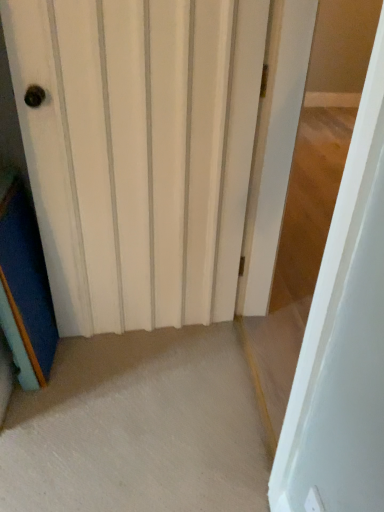
The image size is (384, 512). What do you see at coordinates (343, 340) in the screenshot?
I see `white matte door at center, acting as the second door starting from the left` at bounding box center [343, 340].

You are a GUI agent. You are given a task and a screenshot of the screen. Output one action in this format:
    pyautogui.click(x=<x>, y=<y>)
    Task: Click on the white matte door at center, the 1th door when ordered from right to left
    The image size is (384, 512).
    Given the screenshot: What is the action you would take?
    pyautogui.click(x=343, y=340)

At what (x,y) coordinates should I click in order to perform the action: click on white wood door at center, positioned as the 1th door in left-to-right order. Please return your answer as a coordinate pair (x, y). This screenshot has width=384, height=512. Looking at the image, I should click on (139, 152).

What is the approximate height of white wood door at center, positioned as the 1th door in left-to-right order?

It is 4.07 feet.

The image size is (384, 512). What do you see at coordinates (139, 152) in the screenshot?
I see `white wood door at center, positioned as the 1th door in left-to-right order` at bounding box center [139, 152].

Identify the location of white matte door at center, the 1th door when ordered from right to left. Image resolution: width=384 pixels, height=512 pixels. (343, 340).

Is white matte door at center, the 1th door when ordered from right to left, at the left side of white wood door at center, arranged as the second door when viewed from the right?

In fact, white matte door at center, the 1th door when ordered from right to left, is to the right of white wood door at center, arranged as the second door when viewed from the right.

Is white matte door at center, the 1th door when ordered from right to left, further to camera compared to white wood door at center, arranged as the second door when viewed from the right?

No, white matte door at center, the 1th door when ordered from right to left, is closer to the viewer.

Considering the positions of point (365, 496) and point (26, 147), is point (365, 496) closer or farther from the camera than point (26, 147)?

Point (365, 496) appears to be closer to the viewer than point (26, 147).

From the image's perspective, is white matte door at center, acting as the second door starting from the left, positioned above or below white wood door at center, positioned as the 1th door in left-to-right order?

From the image's perspective, white matte door at center, acting as the second door starting from the left, appears below white wood door at center, positioned as the 1th door in left-to-right order.

From a real-world perspective, is white matte door at center, the 1th door when ordered from right to left, located beneath white wood door at center, positioned as the 1th door in left-to-right order?

Incorrect, from a real-world perspective, white matte door at center, the 1th door when ordered from right to left, is higher than white wood door at center, positioned as the 1th door in left-to-right order.

Considering the relative sizes of white matte door at center, acting as the second door starting from the left, and white wood door at center, positioned as the 1th door in left-to-right order, in the image provided, is white matte door at center, acting as the second door starting from the left, wider than white wood door at center, positioned as the 1th door in left-to-right order,?

A: Yes, white matte door at center, acting as the second door starting from the left, is wider than white wood door at center, positioned as the 1th door in left-to-right order.

Considering the sizes of white matte door at center, acting as the second door starting from the left, and white wood door at center, positioned as the 1th door in left-to-right order, in the image, is white matte door at center, acting as the second door starting from the left, taller or shorter than white wood door at center, positioned as the 1th door in left-to-right order,?

Clearly, white matte door at center, acting as the second door starting from the left, is taller compared to white wood door at center, positioned as the 1th door in left-to-right order.

Can you confirm if white matte door at center, acting as the second door starting from the left, is bigger than white wood door at center, arranged as the second door when viewed from the right?

Indeed, white matte door at center, acting as the second door starting from the left, has a larger size compared to white wood door at center, arranged as the second door when viewed from the right.

Can white wood door at center, positioned as the 1th door in left-to-right order, be found inside white matte door at center, acting as the second door starting from the left?

Definitely not — white wood door at center, positioned as the 1th door in left-to-right order, is not inside white matte door at center, acting as the second door starting from the left.

Can you see white matte door at center, acting as the second door starting from the left, touching white wood door at center, positioned as the 1th door in left-to-right order?

They are not placed beside each other.

Is white matte door at center, acting as the second door starting from the left, facing away from white wood door at center, positioned as the 1th door in left-to-right order?

No.

How different are the orientations of white matte door at center, the 1th door when ordered from right to left, and white wood door at center, arranged as the second door when viewed from the right, in degrees?

94.6 degrees separate the facing orientations of white matte door at center, the 1th door when ordered from right to left, and white wood door at center, arranged as the second door when viewed from the right.

The width and height of the screenshot is (384, 512). In the image, there is a white matte door at center, acting as the second door starting from the left. In order to click on door below it (from a real-world perspective) in this screenshot , I will do `click(139, 152)`.

Visually, is white wood door at center, arranged as the second door when viewed from the right, positioned to the left or to the right of white matte door at center, acting as the second door starting from the left?

white wood door at center, arranged as the second door when viewed from the right, is to the left of white matte door at center, acting as the second door starting from the left.

Which object is further away from the camera, white wood door at center, positioned as the 1th door in left-to-right order, or white matte door at center, the 1th door when ordered from right to left?

white wood door at center, positioned as the 1th door in left-to-right order, is more distant.

Is point (166, 253) closer or farther from the camera than point (297, 488)?

Point (166, 253) is positioned farther from the camera compared to point (297, 488).

In the scene shown: From the image's perspective, between white wood door at center, positioned as the 1th door in left-to-right order, and white matte door at center, the 1th door when ordered from right to left, who is located below?

white matte door at center, the 1th door when ordered from right to left.

From a real-world perspective, is white wood door at center, arranged as the second door when viewed from the right, above or below white matte door at center, the 1th door when ordered from right to left?

From a real-world perspective, white wood door at center, arranged as the second door when viewed from the right, is physically below white matte door at center, the 1th door when ordered from right to left.

Which of these two, white wood door at center, positioned as the 1th door in left-to-right order, or white matte door at center, the 1th door when ordered from right to left, is wider?

white matte door at center, the 1th door when ordered from right to left.

Consider the image. Does white wood door at center, arranged as the second door when viewed from the right, have a greater height compared to white matte door at center, the 1th door when ordered from right to left?

No, white wood door at center, arranged as the second door when viewed from the right, is not taller than white matte door at center, the 1th door when ordered from right to left.

Is white wood door at center, arranged as the second door when viewed from the right, bigger than white matte door at center, the 1th door when ordered from right to left?

Actually, white wood door at center, arranged as the second door when viewed from the right, might be smaller than white matte door at center, the 1th door when ordered from right to left.

Would you say white wood door at center, arranged as the second door when viewed from the right, contains white matte door at center, acting as the second door starting from the left?

Actually, white matte door at center, acting as the second door starting from the left, is outside white wood door at center, arranged as the second door when viewed from the right.

Is white wood door at center, positioned as the 1th door in left-to-right order, placed right next to white matte door at center, the 1th door when ordered from right to left?

No, white wood door at center, positioned as the 1th door in left-to-right order, is not in contact with white matte door at center, the 1th door when ordered from right to left.

Is white wood door at center, positioned as the 1th door in left-to-right order, facing away from white matte door at center, the 1th door when ordered from right to left?

No, white wood door at center, positioned as the 1th door in left-to-right order, is not facing away from white matte door at center, the 1th door when ordered from right to left.

Can you tell me how much white wood door at center, arranged as the second door when viewed from the right, and white matte door at center, the 1th door when ordered from right to left, differ in facing direction?

The facing directions of white wood door at center, arranged as the second door when viewed from the right, and white matte door at center, the 1th door when ordered from right to left, are 94.6 degrees apart.

How far apart are white wood door at center, arranged as the second door when viewed from the right, and white matte door at center, the 1th door when ordered from right to left?

white wood door at center, arranged as the second door when viewed from the right, is 32.99 inches from white matte door at center, the 1th door when ordered from right to left.

Identify the location of door above the white matte door at center, acting as the second door starting from the left (from the image's perspective). (139, 152).

Locate an element on the screen. The width and height of the screenshot is (384, 512). door above the white matte door at center, acting as the second door starting from the left (from the image's perspective) is located at coordinates (139, 152).

At what (x,y) coordinates should I click in order to perform the action: click on door that is below the white wood door at center, arranged as the second door when viewed from the right (from the image's perspective). Please return your answer as a coordinate pair (x, y). Image resolution: width=384 pixels, height=512 pixels. Looking at the image, I should click on pos(343,340).